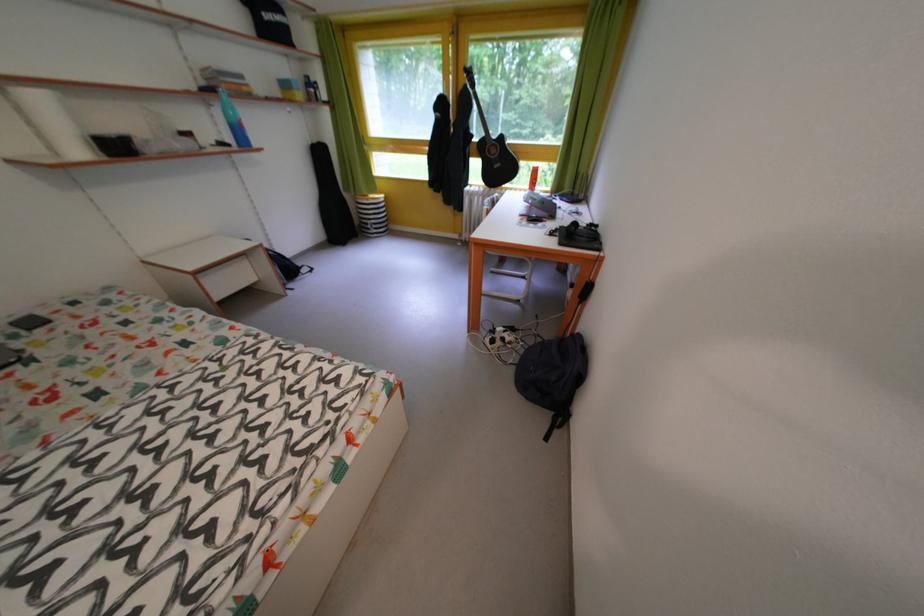
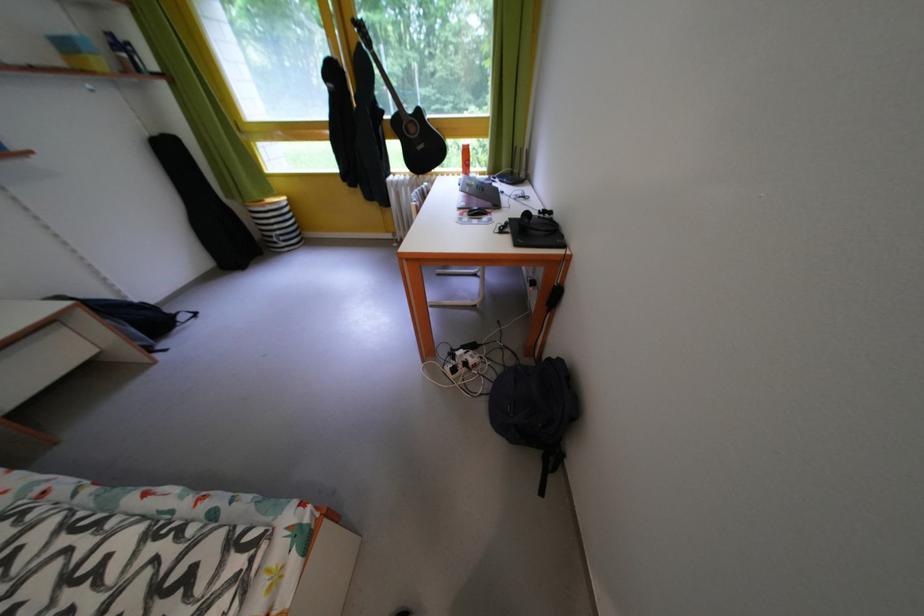
The point at (581,341) is marked in the first image. Where is the corresponding point in the second image?

(558, 365)